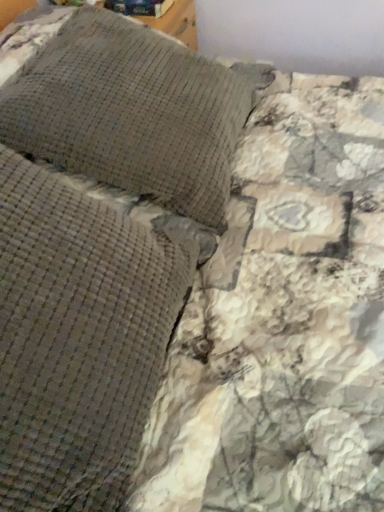
Question: Is woven fabric pillow at upper left, positioned as the 2th pillow in back-to-front order, in front of or behind woven fabric pillow at upper left, the second pillow when ordered from front to back, in the image?

Choices:
 (A) behind
 (B) front

Answer: (B)

Question: Considering the positions of point (84, 267) and point (122, 130), is point (84, 267) closer or farther from the camera than point (122, 130)?

Choices:
 (A) closer
 (B) farther

Answer: (A)

Question: Is woven fabric pillow at upper left, positioned as the 2th pillow in back-to-front order, spatially inside woven fabric pillow at upper left, the second pillow when ordered from front to back, or outside of it?

Choices:
 (A) outside
 (B) inside

Answer: (A)

Question: In the image, is woven fabric pillow at upper left, acting as the first pillow starting from the back, positioned in front of or behind woven fabric pillow at upper left, positioned as the 2th pillow in back-to-front order?

Choices:
 (A) front
 (B) behind

Answer: (B)

Question: Is point (210, 204) closer or farther from the camera than point (145, 351)?

Choices:
 (A) farther
 (B) closer

Answer: (A)

Question: Is woven fabric pillow at upper left, acting as the first pillow starting from the back, inside or outside of woven fabric pillow at upper left, positioned as the 2th pillow in back-to-front order?

Choices:
 (A) outside
 (B) inside

Answer: (A)

Question: From the image's perspective, is woven fabric pillow at upper left, the second pillow when ordered from front to back, positioned above or below woven fabric pillow at upper left, which ranks as the first pillow in front-to-back order?

Choices:
 (A) below
 (B) above

Answer: (B)